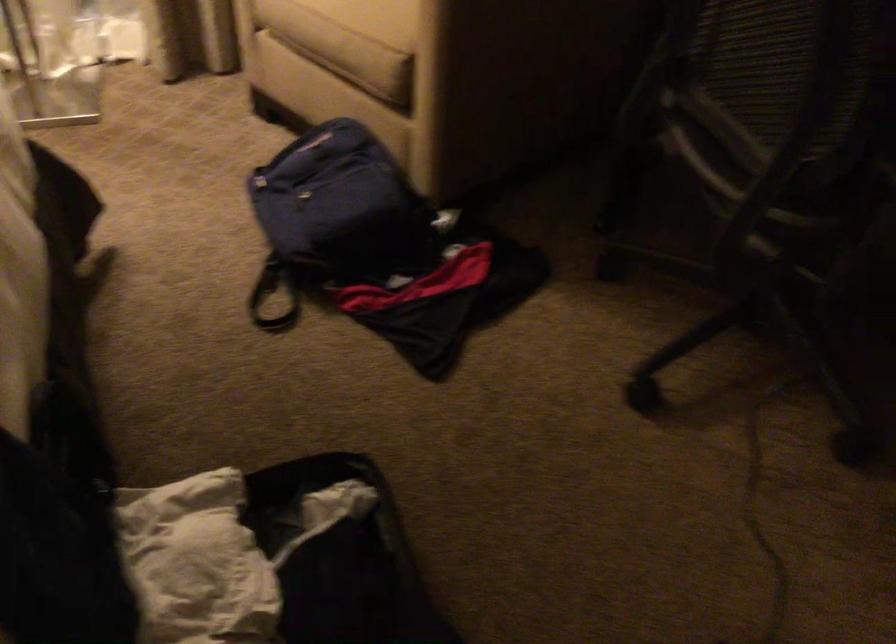
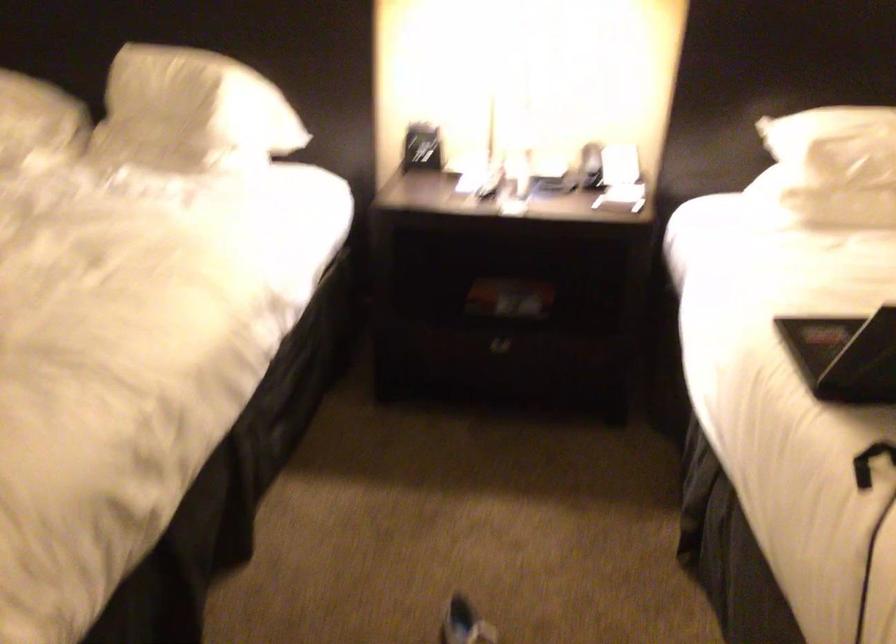
The first image is from the beginning of the video and the second image is from the end. How did the camera likely rotate when shooting the video?

The rotation direction of the camera is left-down.